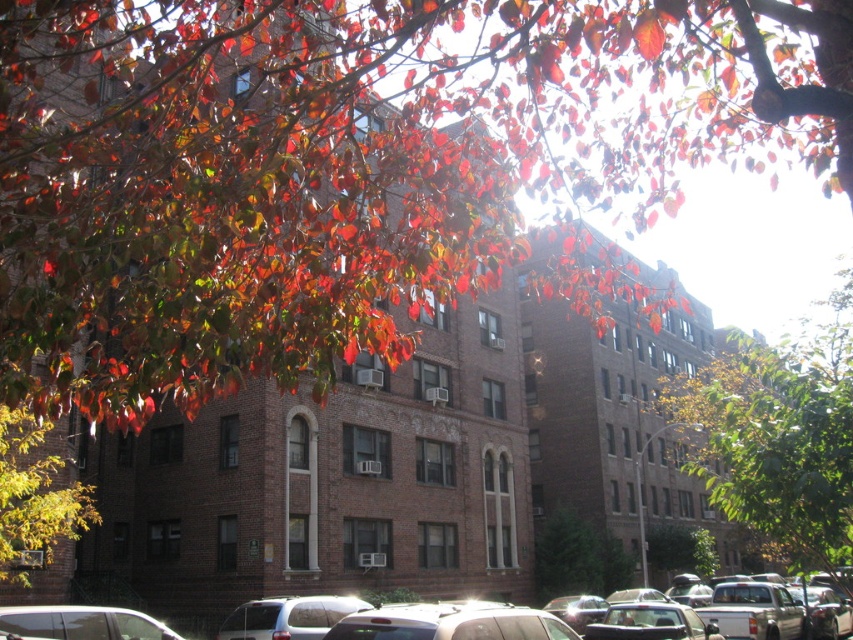
Question: Estimate the real-world distances between objects in this image. Which object is closer to the green leafy tree at center?

Choices:
 (A) shiny green leaves at lower left
 (B) matte silver sedan at center

Answer: (B)

Question: Can you confirm if shiny red leaves at upper center is positioned to the left of shiny green leaves at lower left?

Choices:
 (A) no
 (B) yes

Answer: (A)

Question: Which object is closer to the camera taking this photo?

Choices:
 (A) metallic silver car at lower left
 (B) green leafy tree at center
 (C) matte silver suv at lower center

Answer: (B)

Question: Does matte silver sedan at center have a smaller size compared to matte silver suv at lower center?

Choices:
 (A) yes
 (B) no

Answer: (B)

Question: Which point is closer to the camera taking this photo?

Choices:
 (A) (76, 632)
 (B) (292, 612)
 (C) (62, 467)
 (D) (3, 51)

Answer: (D)

Question: Is shiny red leaves at upper center wider than shiny green leaves at lower left?

Choices:
 (A) yes
 (B) no

Answer: (A)